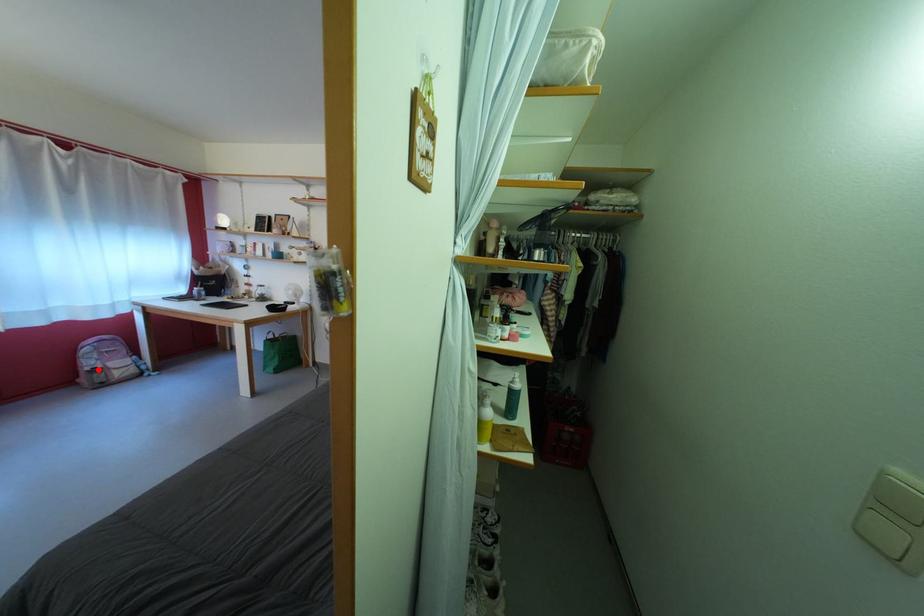
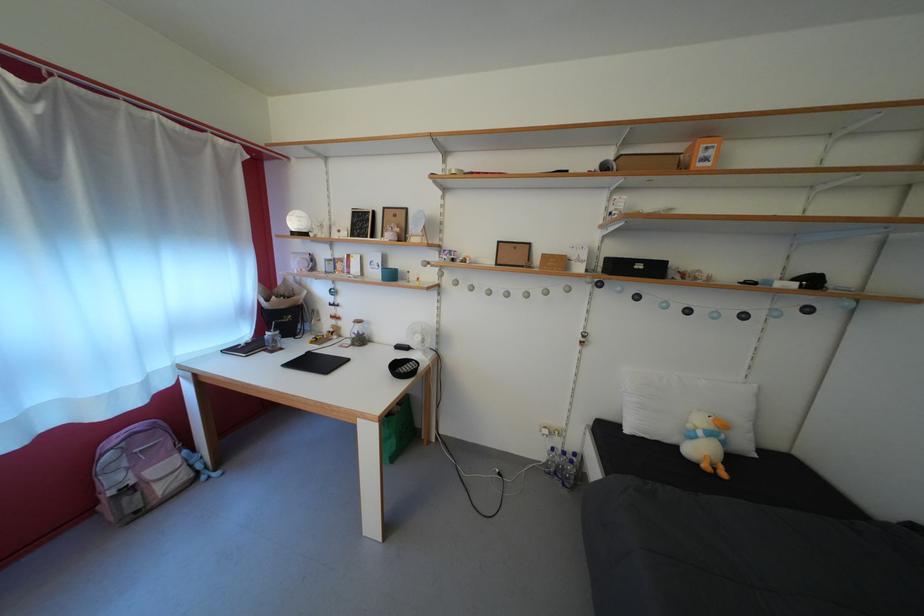
Where in the second image is the point corresponding to the highlighted location from the first image?

(123, 485)